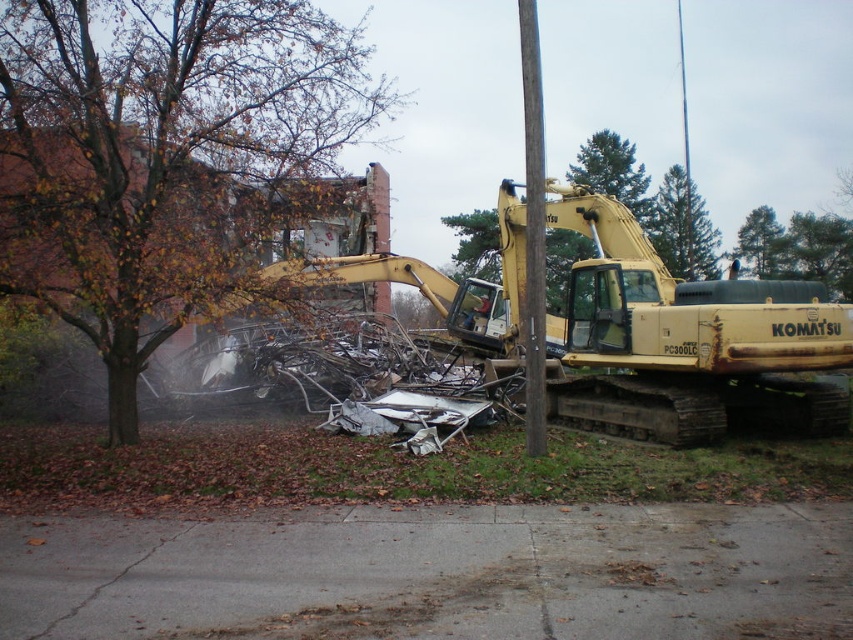
You are standing at the center of the demolition site. You notice two points marked in the image. Which point, point (3, 83) or point (776, 232), is closer to you?

Point (3, 83) is closer to the viewer than point (776, 232).

You are a construction worker assessing the demolition site. You notice the yellow metallic excavator at center and the brown wooden pole at center. Which object is shorter?

Result: The yellow metallic excavator at center is shorter than the brown wooden pole at center.